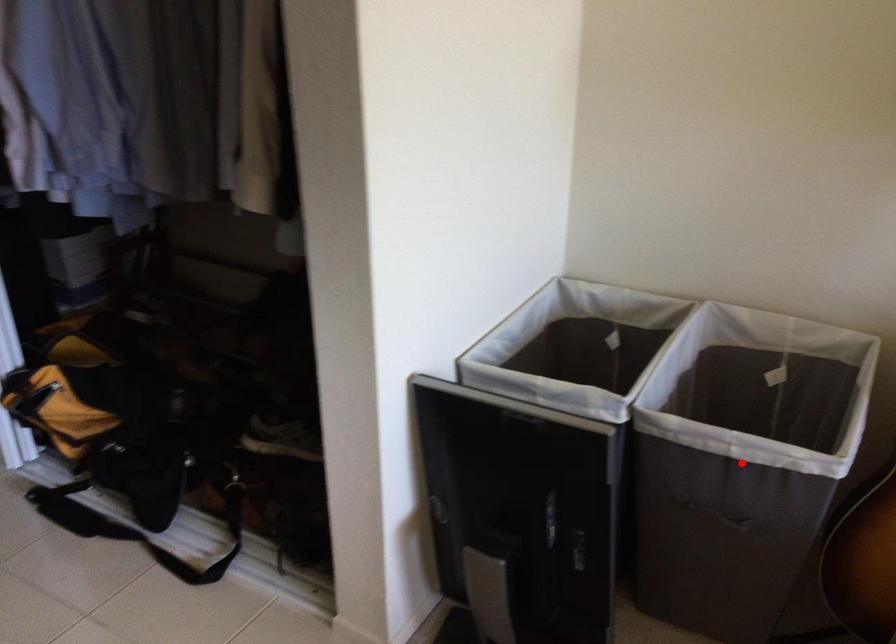
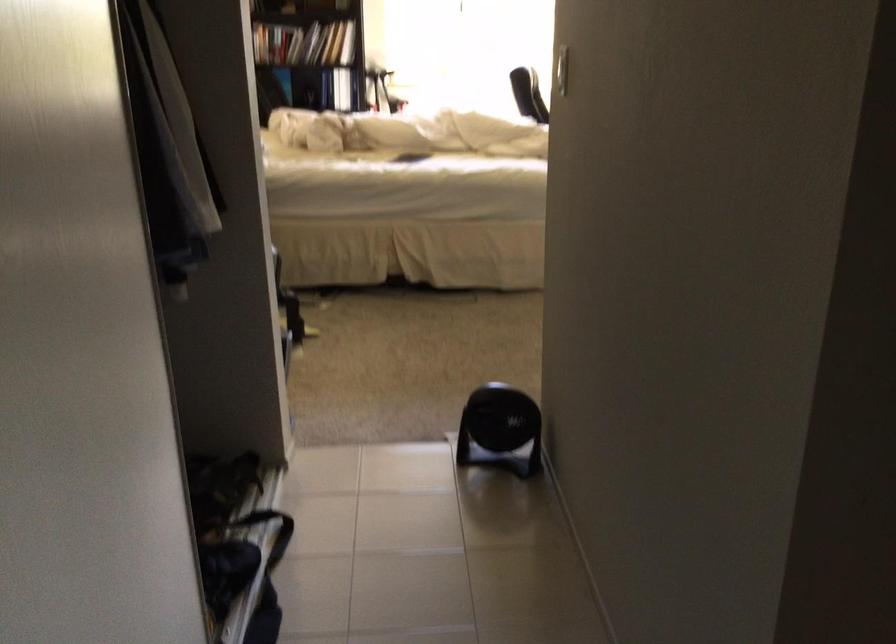
Question: I am providing you with two images of the same scene from different viewpoints. A red point is marked on the first image. Is the red point's position out of view in image 2?

Choices:
 (A) Yes
 (B) No

Answer: (A)